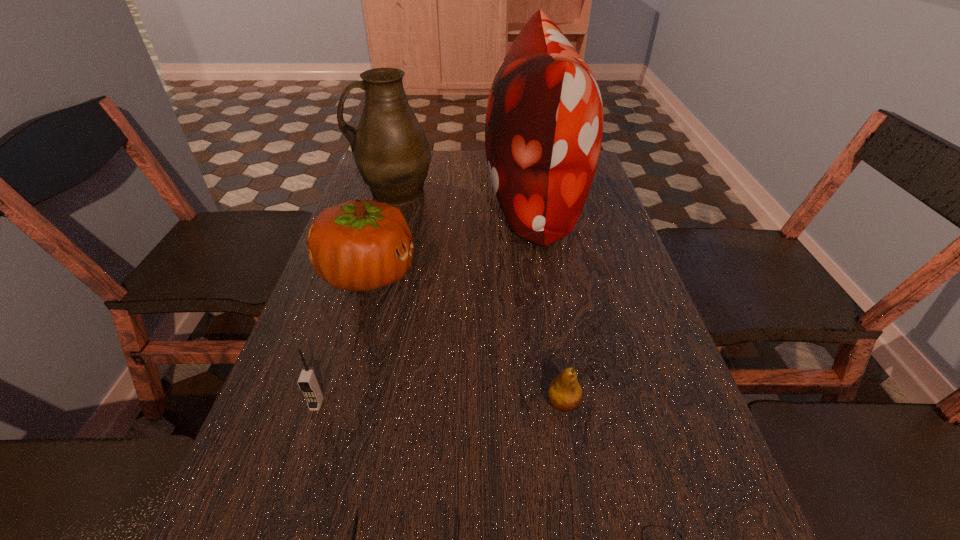
You are a GUI agent. You are given a task and a screenshot of the screen. Output one action in this format:
    pyautogui.click(x=<x>, y=<y>)
    Task: Click on the vacant space located 0.340m on the back of the pear
    The height and width of the screenshot is (540, 960).
    Given the screenshot: What is the action you would take?
    pyautogui.click(x=541, y=270)

Identify the location of cushion positioned at the far edge. This screenshot has height=540, width=960. (544, 121).

At what (x,y) coordinates should I click in order to perform the action: click on pitcher that is at the far edge. Please return your answer as a coordinate pair (x, y). Looking at the image, I should click on (390, 149).

You are a GUI agent. You are given a task and a screenshot of the screen. Output one action in this format:
    pyautogui.click(x=<x>, y=<y>)
    Task: Click on the pitcher present at the left edge
    
    Given the screenshot: What is the action you would take?
    pyautogui.click(x=390, y=149)

Image resolution: width=960 pixels, height=540 pixels. I want to click on pumpkin located in the left edge section of the desktop, so click(359, 245).

Identify the location of cellular telephone that is at the left edge. (308, 382).

You are a GUI agent. You are given a task and a screenshot of the screen. Output one action in this format:
    pyautogui.click(x=<x>, y=<y>)
    Task: Click on the object present at the right edge
    This screenshot has height=540, width=960.
    Given the screenshot: What is the action you would take?
    pyautogui.click(x=544, y=121)

Locate an element on the screen. object located at the far left corner is located at coordinates (390, 149).

This screenshot has width=960, height=540. I want to click on object located in the far right corner section of the desktop, so click(544, 121).

Locate an element on the screen. Image resolution: width=960 pixels, height=540 pixels. vacant space at the far edge of the desktop is located at coordinates (468, 177).